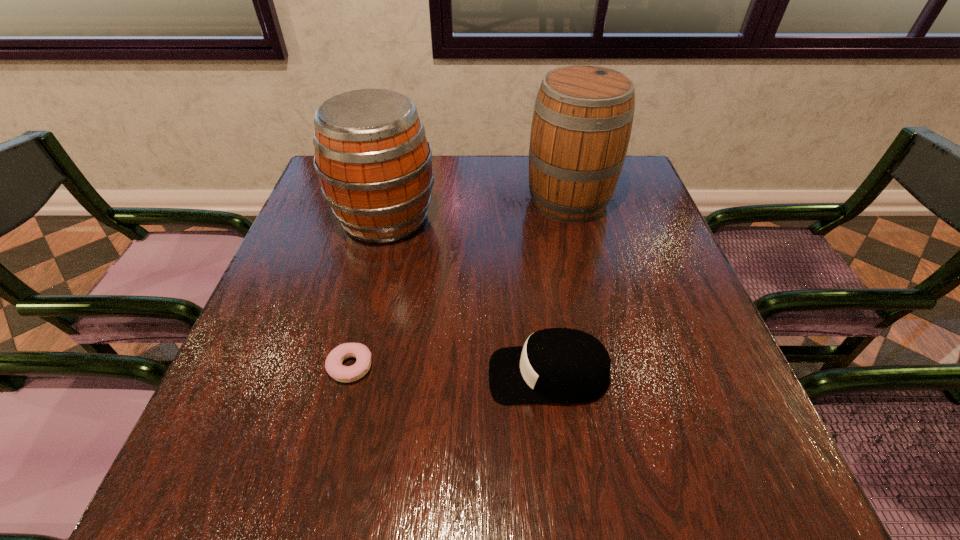
Where is `free point between the left cider and the right cider`? This screenshot has height=540, width=960. free point between the left cider and the right cider is located at coordinates (477, 210).

The height and width of the screenshot is (540, 960). I want to click on unoccupied position between the right cider and the doughnut, so click(x=460, y=284).

Where is `free space that is in between the right cider and the third tallest object`? This screenshot has width=960, height=540. free space that is in between the right cider and the third tallest object is located at coordinates (559, 287).

Identify the location of free space between the second shortest object and the shortest object. (449, 371).

Locate an element on the screen. The height and width of the screenshot is (540, 960). free area in between the doughnut and the cap is located at coordinates (449, 371).

Where is `vacant area that lies between the left cider and the right cider`? This screenshot has width=960, height=540. vacant area that lies between the left cider and the right cider is located at coordinates (477, 210).

The height and width of the screenshot is (540, 960). In order to click on free point between the cap and the shortest object in this screenshot , I will do `click(449, 371)`.

The width and height of the screenshot is (960, 540). I want to click on empty location between the shortest object and the cap, so click(449, 371).

This screenshot has height=540, width=960. Identify the location of free spot between the left cider and the right cider. (477, 210).

Where is `empty location between the right cider and the left cider`? Image resolution: width=960 pixels, height=540 pixels. empty location between the right cider and the left cider is located at coordinates (477, 210).